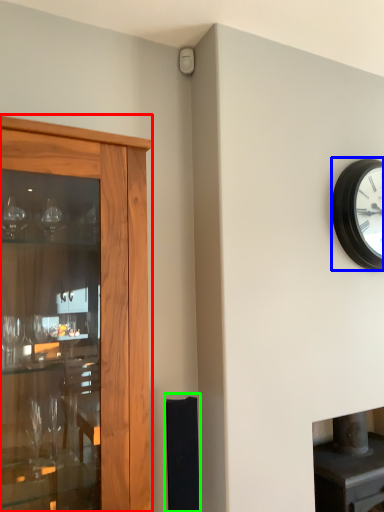
Question: Which object is the farthest from cupboard (highlighted by a red box)? Choose among these: wall clock (highlighted by a blue box) or speaker (highlighted by a green box).

Choices:
 (A) wall clock
 (B) speaker

Answer: (A)